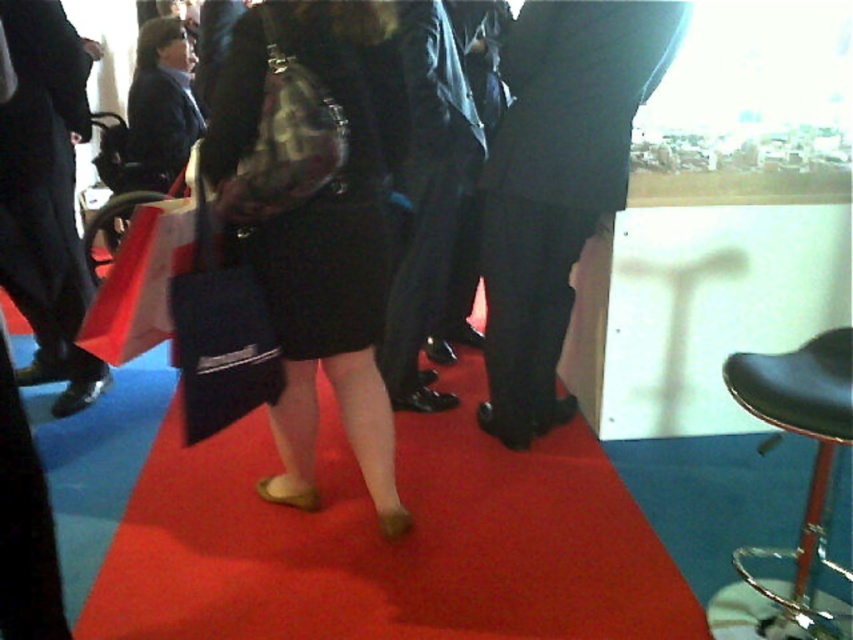
Measure the distance between red carpet at center and camera.

The distance of red carpet at center from camera is 5.92 feet.

Who is higher up, red carpet at center or black leather stool at lower right?

black leather stool at lower right is higher up.

Which is behind, point (225, 513) or point (817, 609)?

The point (225, 513) is more distant.

Where is `red carpet at center`? The image size is (853, 640). red carpet at center is located at coordinates (387, 541).

What do you see at coordinates (320, 230) in the screenshot? I see `matte black skirt at center` at bounding box center [320, 230].

Who is lower down, matte black skirt at center or black leather pants at center?

matte black skirt at center is lower down.

Where is `matte black skirt at center`? The width and height of the screenshot is (853, 640). matte black skirt at center is located at coordinates (320, 230).

Where is `matte black skirt at center`? The image size is (853, 640). matte black skirt at center is located at coordinates (320, 230).

Which is more to the left, red carpet at center or matte black skirt at center?

Positioned to the left is matte black skirt at center.

Is red carpet at center taller than matte black skirt at center?

Incorrect, red carpet at center's height is not larger of matte black skirt at center's.

Describe the element at coordinates (387, 541) in the screenshot. I see `red carpet at center` at that location.

Locate an element on the screen. The image size is (853, 640). red carpet at center is located at coordinates click(x=387, y=541).